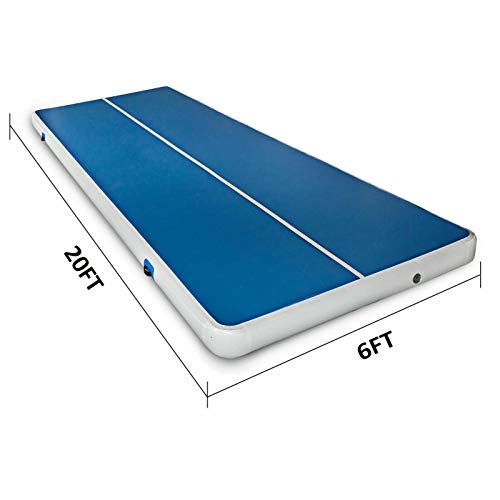
Identify the location of white line dividing length of bed in half. (x=327, y=244).